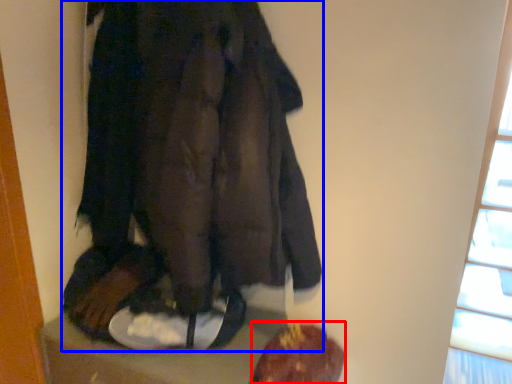
Question: Which of the following is the closest to the observer, food (highlighted by a red box) or fancy dress (highlighted by a blue box)?

Choices:
 (A) food
 (B) fancy dress

Answer: (B)